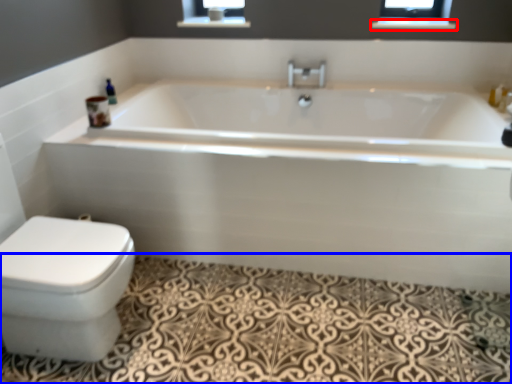
Question: Which object appears closest to the camera in this image, balustrade (highlighted by a red box) or bath mat (highlighted by a blue box)?

Choices:
 (A) balustrade
 (B) bath mat

Answer: (B)